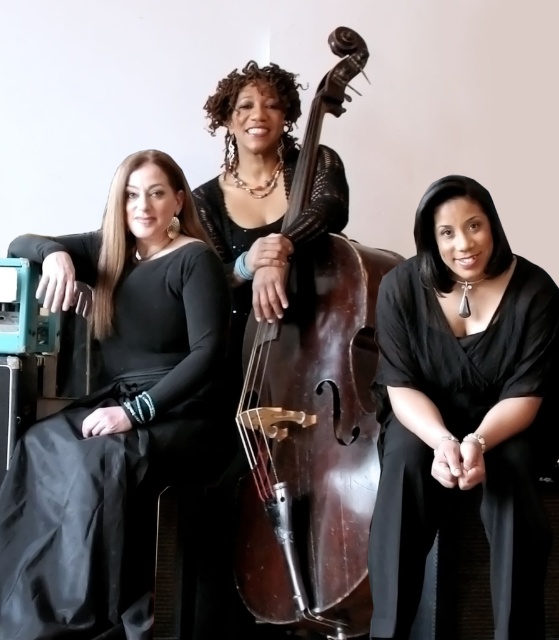
Question: Which object is the farthest from the black matte dress at left?

Choices:
 (A) dark brown polished wood cello at center
 (B) black silk blouse at center

Answer: (B)

Question: Can you confirm if black silk blouse at center is positioned to the left of dark brown polished wood cello at center?

Choices:
 (A) no
 (B) yes

Answer: (A)

Question: Is the position of black silk blouse at center more distant than that of dark brown polished wood cello at center?

Choices:
 (A) no
 (B) yes

Answer: (A)

Question: Can you confirm if black matte dress at left is wider than dark brown polished wood cello at center?

Choices:
 (A) yes
 (B) no

Answer: (A)

Question: Considering the real-world distances, which object is closest to the dark brown polished wood cello at center?

Choices:
 (A) black matte dress at left
 (B) black silk blouse at center

Answer: (B)

Question: Which of these objects is positioned farthest from the black silk blouse at center?

Choices:
 (A) black matte dress at left
 (B) dark brown polished wood cello at center

Answer: (A)